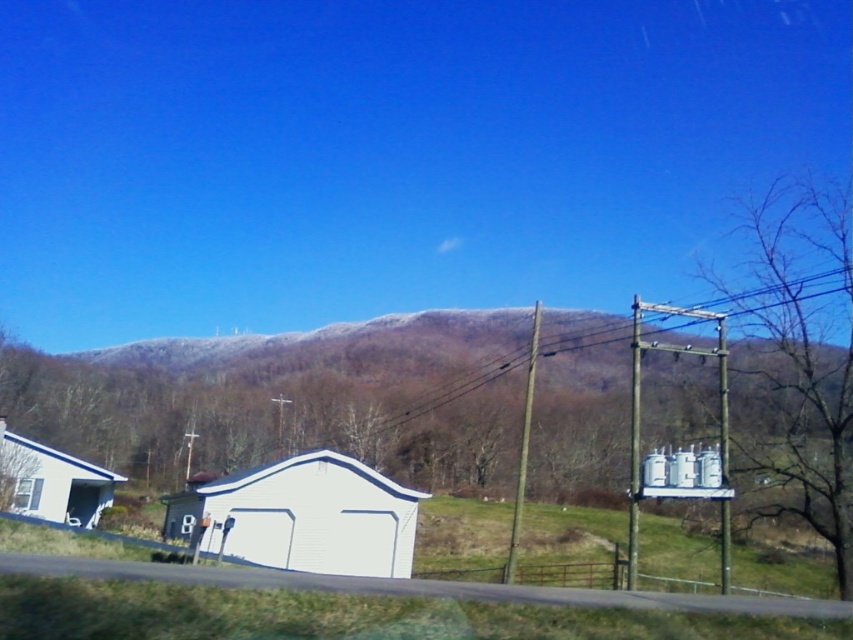
You are a delivery driver trying to park your truck which is 20 feet long. You see the brown wooden power line at center and the white matte garage at lower left. Is there enough space between them to park your truck?

The distance between the brown wooden power line at center and the white matte garage at lower left is 59.90 feet. Since the truck is only 20 feet long, there is sufficient space to park between them.

You are standing in the rural landscape scene. There are two points marked in the image. The first point is at coordinates point [613,333] and the second point is at point [15,488]. Which point is closer to you?

Point [613,333] is closer to the viewer than point [15,488].